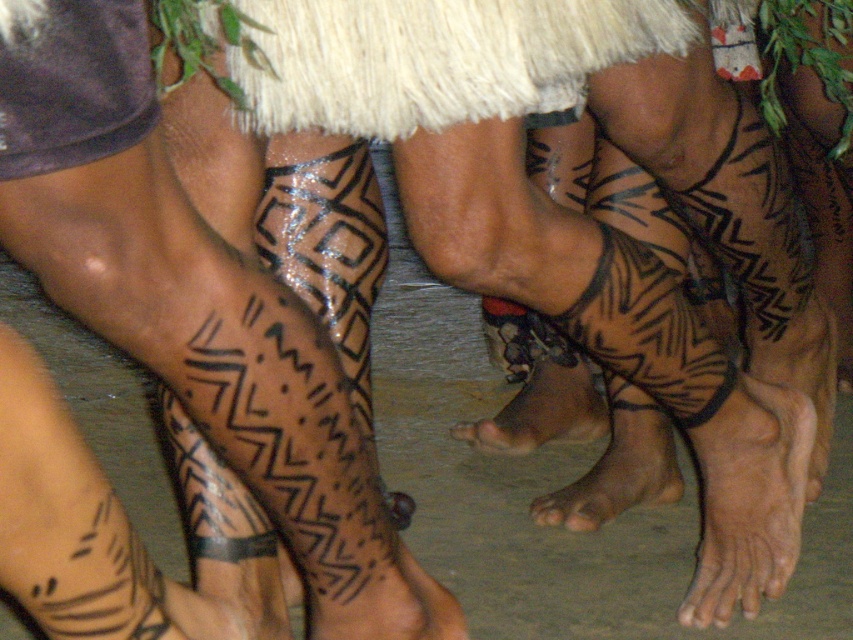
Does skinny flesh-toned foot at lower right appear on the right side of brown skin at lower center?

Indeed, skinny flesh-toned foot at lower right is positioned on the right side of brown skin at lower center.

Is skinny flesh-toned foot at lower right below brown skin at lower center?

Yes, skinny flesh-toned foot at lower right is below brown skin at lower center.

Is point (769, 563) farther from viewer compared to point (579, 394)?

No, (769, 563) is closer to viewer.

Identify the location of skinny flesh-toned foot at lower right. This screenshot has width=853, height=640. click(x=749, y=499).